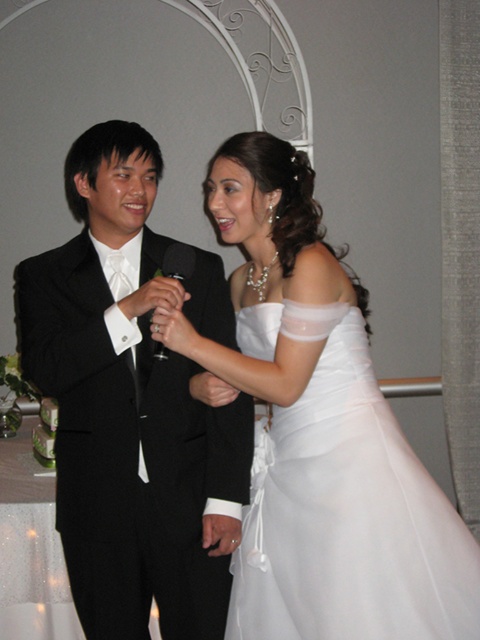
You are standing at the point with coordinates point (61, 435) and want to walk to the point with coordinates point (403, 627). Is there any obstacle between you and your destination?

The point (61, 435) is behind point (403, 627), so there is an obstacle between them.

Looking at this image, you are a photographer at the wedding reception. You need to capture a closeup shot of the black satin suit at left and white satin dress at center. Can you fit both in the frame if your camera has a maximum field of view of 10 inches?

The black satin suit at left is 9.48 inches away from the white satin dress at center. Since the distance between them is less than the camera field of view of 10 inches, both can be captured in the frame.

You are standing at the camera position and want to throw a flower bouquet to the point marked as point (156, 365). If your throwing range is 5 feet, will you be able to reach that point?

The distance of point (156, 365) from camera is 5.32 feet, which is slightly beyond your throwing range of 5 feet. Therefore, you won not be able to reach that point.